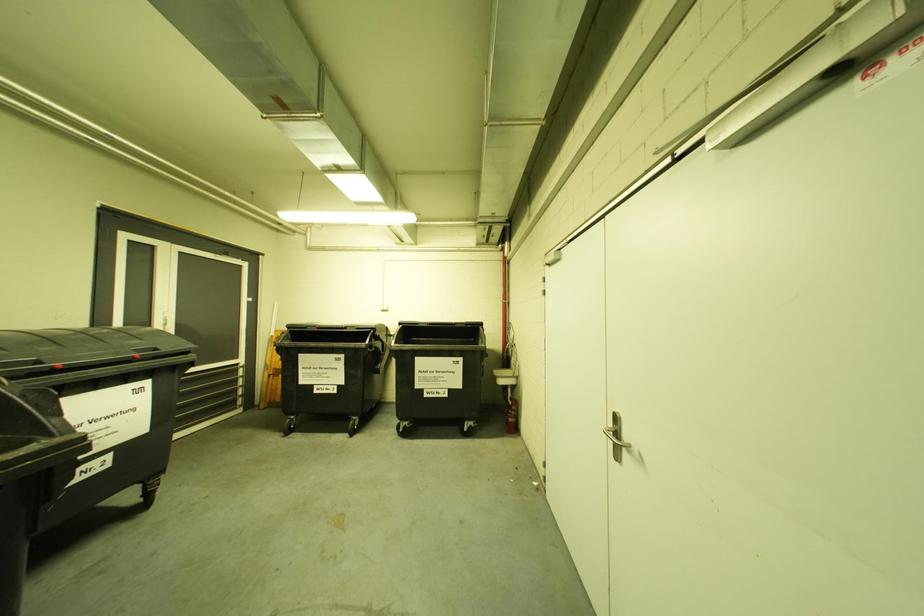
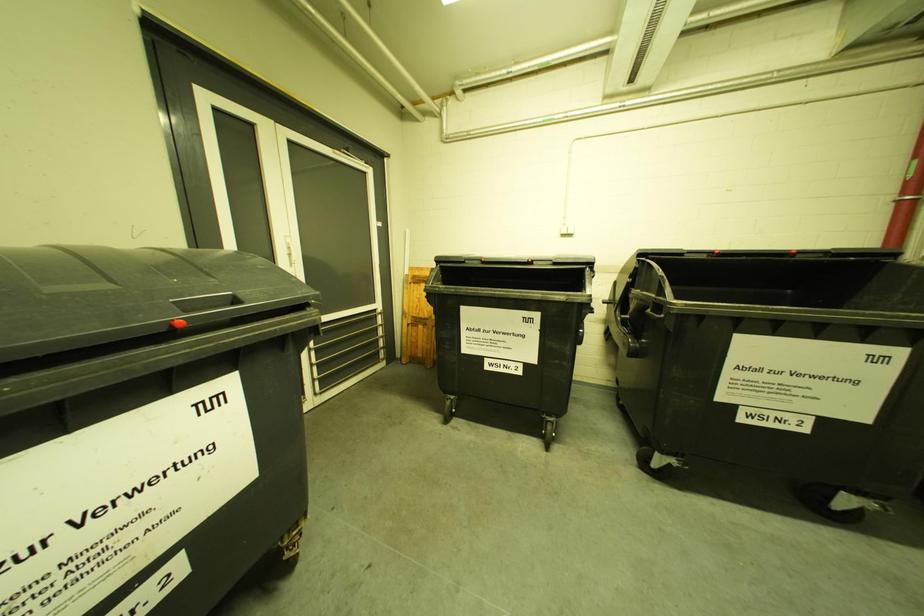
In a continuous first-person perspective shot, in which direction is the camera moving?

The cameraman moved toward left, forward.